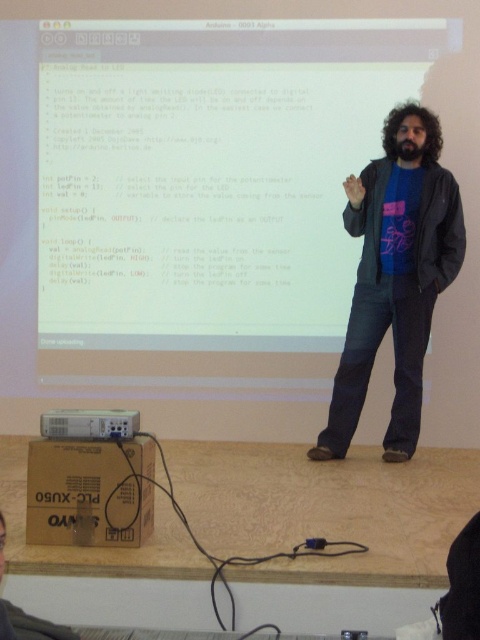
Is point (398, 444) farther from camera compared to point (124, 426)?

Yes, it is behind point (124, 426).

Between blue cotton t-shirt at center and white plastic projector at lower left, which one has less height?

With less height is white plastic projector at lower left.

The height and width of the screenshot is (640, 480). What are the coordinates of `blue cotton t-shirt at center` in the screenshot? It's located at (396, 276).

Image resolution: width=480 pixels, height=640 pixels. I want to click on blue cotton t-shirt at center, so click(x=396, y=276).